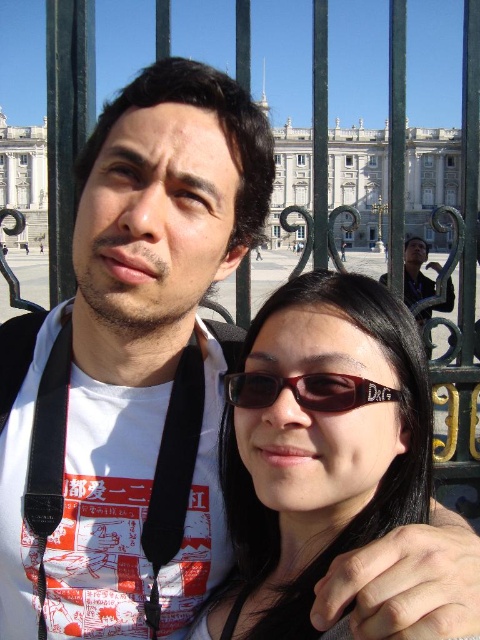
Question: Which object appears closest to the camera in this image?

Choices:
 (A) brown matte sunglasses at center
 (B) black plastic sunglasses at center

Answer: (B)

Question: Is black plastic sunglasses at center thinner than brown matte sunglasses at center?

Choices:
 (A) no
 (B) yes

Answer: (A)

Question: Which of the following is the closest to the observer?

Choices:
 (A) [292, 440]
 (B) [372, 403]

Answer: (A)

Question: Which object appears closest to the camera in this image?

Choices:
 (A) black plastic sunglasses at center
 (B) brown matte sunglasses at center

Answer: (A)

Question: Is black plastic sunglasses at center positioned in front of brown matte sunglasses at center?

Choices:
 (A) no
 (B) yes

Answer: (B)

Question: Does black plastic sunglasses at center appear on the right side of brown matte sunglasses at center?

Choices:
 (A) no
 (B) yes

Answer: (B)